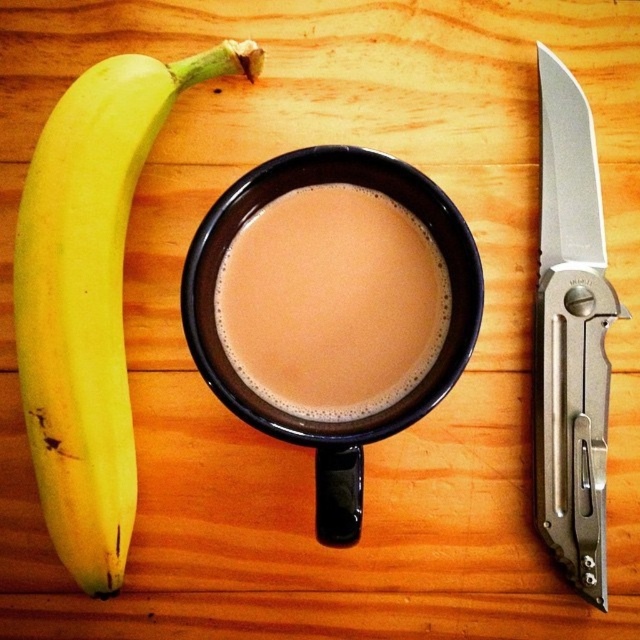
Based on the photo, who is positioned more to the right, yellow matte banana at left or matte ceramic mug at center?

matte ceramic mug at center is more to the right.

This screenshot has height=640, width=640. In order to click on yellow matte banana at left in this screenshot , I will do `click(90, 298)`.

Consider the image. Can you confirm if brown matte mug at center is positioned to the left of matte ceramic mug at center?

Incorrect, brown matte mug at center is not on the left side of matte ceramic mug at center.

Does brown matte mug at center come behind matte ceramic mug at center?

Yes.

What do you see at coordinates (332, 301) in the screenshot? I see `brown matte mug at center` at bounding box center [332, 301].

This screenshot has height=640, width=640. What are the coordinates of `brown matte mug at center` in the screenshot? It's located at (332, 301).

Does silver metallic pocketknife at right appear over matte ceramic mug at center?

Correct, silver metallic pocketknife at right is located above matte ceramic mug at center.

Between point (552, 259) and point (385, 164), which one is positioned in front?

Point (385, 164) is more forward.

The height and width of the screenshot is (640, 640). I want to click on silver metallic pocketknife at right, so click(570, 336).